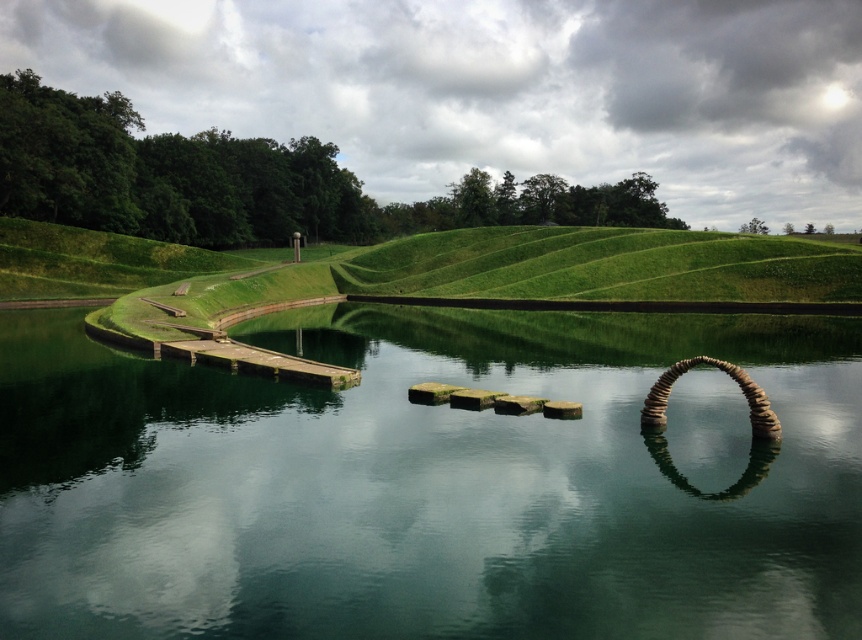
From the picture: Is green reflective water at center closer to camera compared to wooden pier at left?

Yes.

Does point (611, 436) lie in front of point (248, 364)?

Yes, point (611, 436) is in front of point (248, 364).

Who is more forward, (628, 440) or (320, 381)?

Point (628, 440) is more forward.

Where is `green reflective water at center`? The width and height of the screenshot is (862, 640). green reflective water at center is located at coordinates (431, 481).